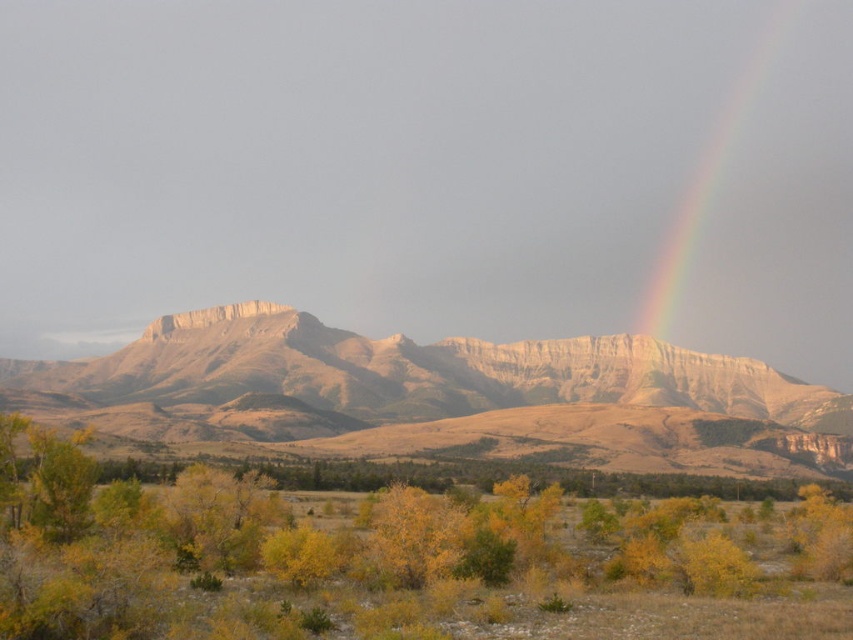
You are an artist planning to paint the scene. You want to place a yellow leafy shrub at lower center in your painting. Where should you position it relative to the rainbow at upper right?

The yellow leafy shrub at lower center should be placed to the left of the rainbow at upper right.

You are standing at the base of the rugged sandstone mountain range at center and want to reach the yellow leafy shrub at lower center. Which direction should you move to get there?

To reach the yellow leafy shrub at lower center from the rugged sandstone mountain range at center, you should move downward since the shrub is positioned under the mountain range.